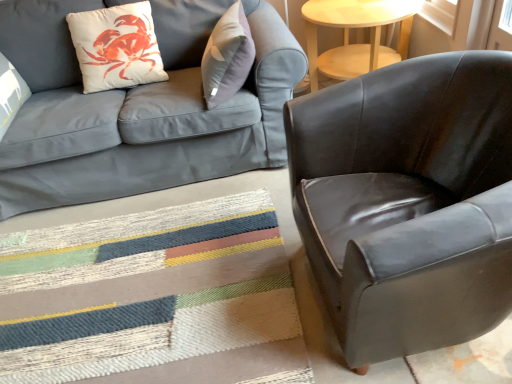
Question: Can you confirm if white matte throw pillow at upper left is positioned to the right of matte gray fabric couch at upper left?

Choices:
 (A) yes
 (B) no

Answer: (A)

Question: Is white matte throw pillow at upper left positioned with its back to matte gray fabric couch at upper left?

Choices:
 (A) no
 (B) yes

Answer: (B)

Question: Is white matte throw pillow at upper left taller than matte gray fabric couch at upper left?

Choices:
 (A) yes
 (B) no

Answer: (B)

Question: Is white matte throw pillow at upper left thinner than matte gray fabric couch at upper left?

Choices:
 (A) yes
 (B) no

Answer: (A)

Question: Could you tell me if white matte throw pillow at upper left is facing matte gray fabric couch at upper left?

Choices:
 (A) yes
 (B) no

Answer: (A)

Question: From a real-world perspective, is matte gray fabric couch at upper left positioned above or below white matte throw pillow at upper left?

Choices:
 (A) above
 (B) below

Answer: (B)

Question: Considering the positions of point (281, 97) and point (71, 26), is point (281, 97) closer or farther from the camera than point (71, 26)?

Choices:
 (A) closer
 (B) farther

Answer: (A)

Question: Is matte gray fabric couch at upper left taller or shorter than white matte throw pillow at upper left?

Choices:
 (A) short
 (B) tall

Answer: (B)

Question: From the image's perspective, is matte gray fabric couch at upper left positioned above or below white matte throw pillow at upper left?

Choices:
 (A) below
 (B) above

Answer: (A)

Question: Considering the relative positions of matte gray fabric couch at upper left and glossy leather armchair at right in the image provided, is matte gray fabric couch at upper left to the left or to the right of glossy leather armchair at right?

Choices:
 (A) right
 (B) left

Answer: (B)

Question: Is matte gray fabric couch at upper left inside the boundaries of glossy leather armchair at right, or outside?

Choices:
 (A) inside
 (B) outside

Answer: (B)

Question: Is matte gray fabric couch at upper left wider or thinner than glossy leather armchair at right?

Choices:
 (A) thin
 (B) wide

Answer: (B)

Question: Considering their positions, is matte gray fabric couch at upper left located in front of or behind glossy leather armchair at right?

Choices:
 (A) front
 (B) behind

Answer: (B)

Question: Looking at their shapes, would you say glossy leather armchair at right is wider or thinner than light wood round table at upper right?

Choices:
 (A) thin
 (B) wide

Answer: (B)

Question: Is glossy leather armchair at right in front of or behind light wood round table at upper right in the image?

Choices:
 (A) front
 (B) behind

Answer: (A)